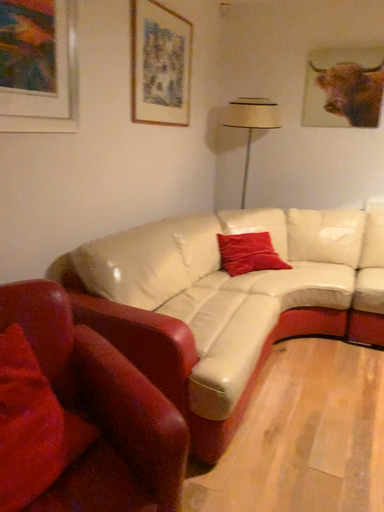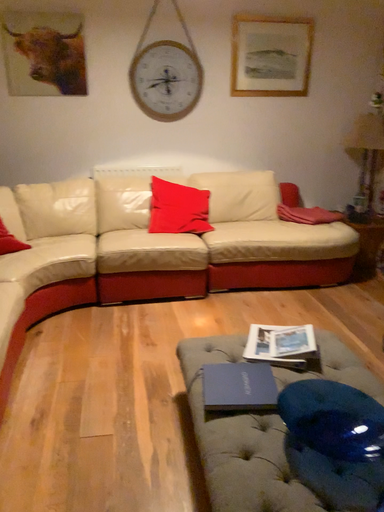
Question: How did the camera likely rotate when shooting the video?

Choices:
 (A) rotated left
 (B) rotated right

Answer: (B)